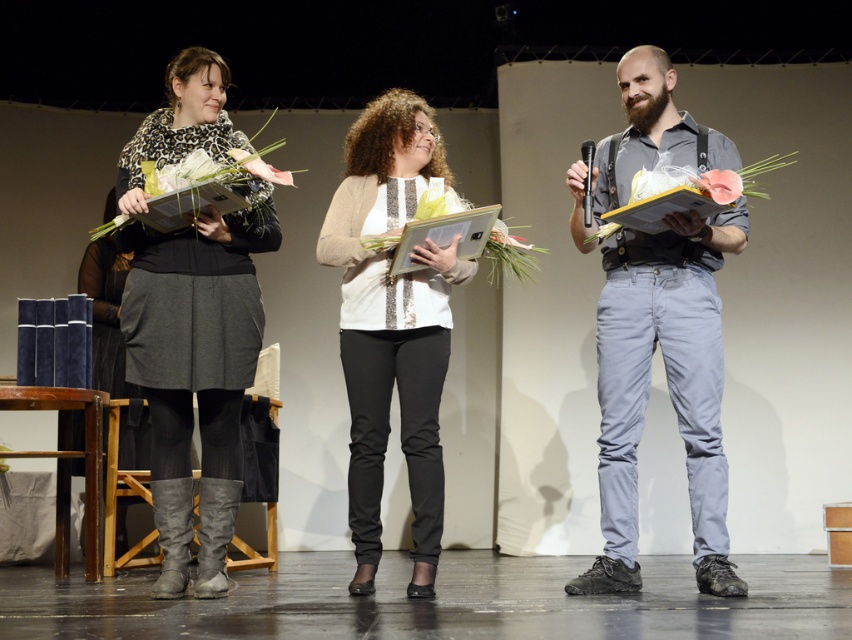
Which is behind, point (597, 484) or point (728, 200)?

The point (597, 484) is more distant.

Which is behind, point (723, 556) or point (727, 193)?

The point (723, 556) is more distant.

Where is `matte gray pants at center`? The width and height of the screenshot is (852, 640). matte gray pants at center is located at coordinates (666, 387).

Can you confirm if matte gray pants at center is thinner than white sequined blouse at center?

In fact, matte gray pants at center might be wider than white sequined blouse at center.

Identify the location of matte gray pants at center. The height and width of the screenshot is (640, 852). 666,387.

This screenshot has width=852, height=640. Find the location of `matte gray pants at center`. matte gray pants at center is located at coordinates click(x=666, y=387).

Which is more to the left, leopard print sweater at left or matte white flower at center?

Positioned to the left is leopard print sweater at left.

Who is more forward, (193, 365) or (724, 193)?

Point (724, 193) is more forward.

The height and width of the screenshot is (640, 852). What do you see at coordinates (194, 372) in the screenshot? I see `leopard print sweater at left` at bounding box center [194, 372].

I want to click on leopard print sweater at left, so click(194, 372).